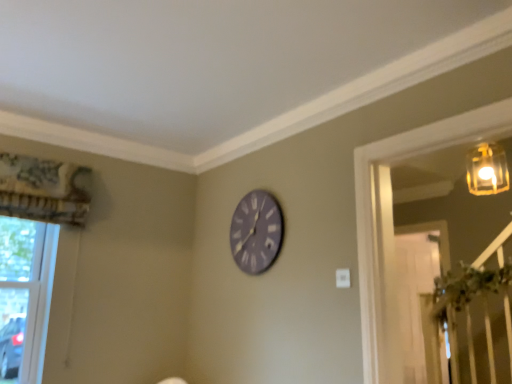
Question: Is clear glass window at lower left situated inside matte gray clock at center or outside?

Choices:
 (A) outside
 (B) inside

Answer: (A)

Question: Considering the positions of clear glass window at lower left and matte gray clock at center in the image, is clear glass window at lower left bigger or smaller than matte gray clock at center?

Choices:
 (A) big
 (B) small

Answer: (A)

Question: Is clear glass window at lower left taller or shorter than matte gray clock at center?

Choices:
 (A) tall
 (B) short

Answer: (A)

Question: Based on their positions, is matte gray clock at center located to the left or right of clear glass window at lower left?

Choices:
 (A) left
 (B) right

Answer: (B)

Question: Choose the correct answer: Is matte gray clock at center inside clear glass window at lower left or outside it?

Choices:
 (A) inside
 (B) outside

Answer: (B)

Question: Is point (282, 231) closer or farther from the camera than point (44, 253)?

Choices:
 (A) closer
 (B) farther

Answer: (A)

Question: From the image's perspective, is matte gray clock at center above or below clear glass window at lower left?

Choices:
 (A) above
 (B) below

Answer: (A)